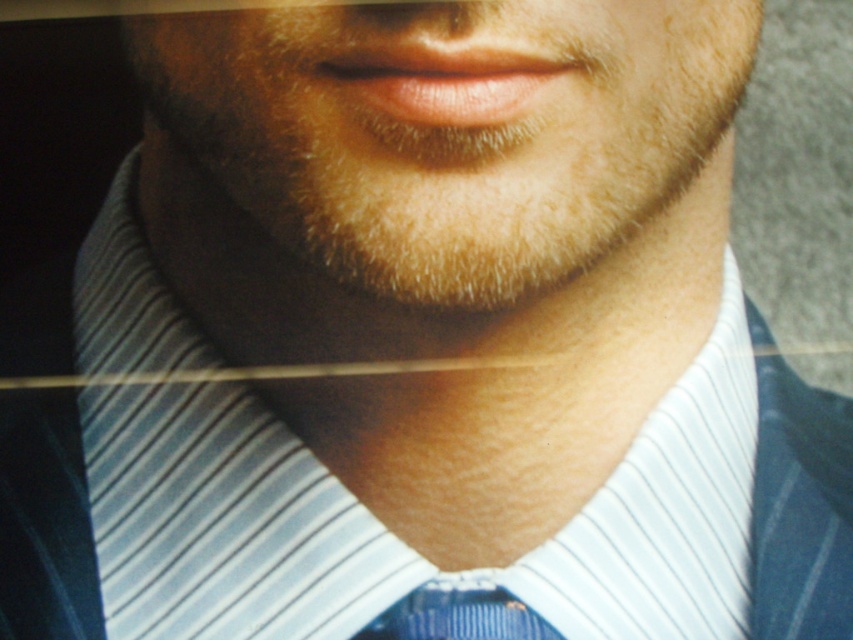
Is smooth skin at center below blue striped tie at center?

Actually, smooth skin at center is above blue striped tie at center.

Which is behind, point (757, 32) or point (398, 632)?

The point (398, 632) is more distant.

Image resolution: width=853 pixels, height=640 pixels. I want to click on smooth skin at center, so click(444, 141).

Which is more to the right, white striped fabric at center or blue striped tie at center?

blue striped tie at center is more to the right.

Can you confirm if white striped fabric at center is wider than blue striped tie at center?

Correct, the width of white striped fabric at center exceeds that of blue striped tie at center.

Does point (190, 516) come in front of point (531, 609)?

No.

This screenshot has height=640, width=853. In order to click on white striped fabric at center in this screenshot , I will do `click(364, 506)`.

Is smooth skin at center wider than white striped fabric at center?

In fact, smooth skin at center might be narrower than white striped fabric at center.

Where is `smooth skin at center`? The width and height of the screenshot is (853, 640). smooth skin at center is located at coordinates (444, 141).

I want to click on smooth skin at center, so click(444, 141).